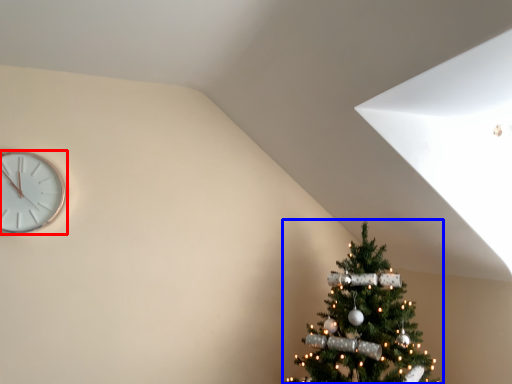
Question: Which of the following is the farthest to the observer, wall clock (highlighted by a red box) or christmas tree (highlighted by a blue box)?

Choices:
 (A) wall clock
 (B) christmas tree

Answer: (A)